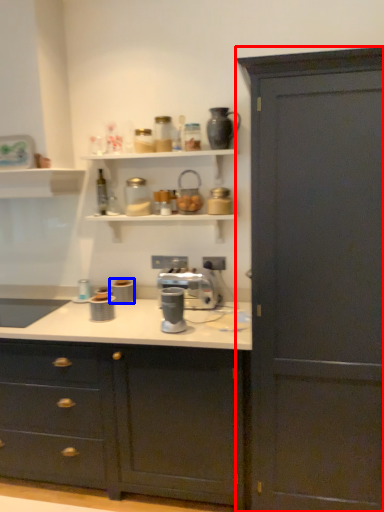
Question: Which object is closer to the camera taking this photo, cabinetry (highlighted by a red box) or appliance (highlighted by a blue box)?

Choices:
 (A) cabinetry
 (B) appliance

Answer: (A)